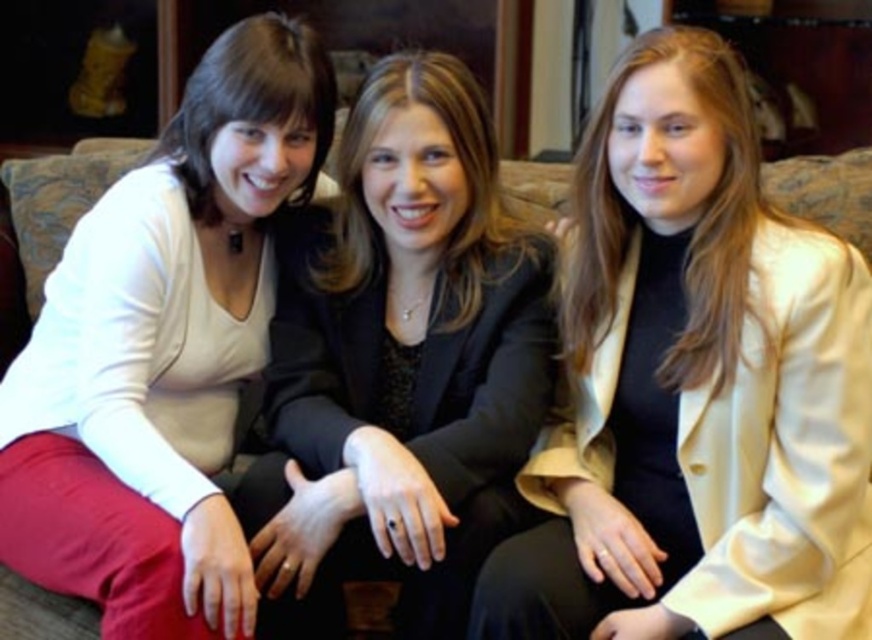
Question: Which of the following is the closest to the observer?

Choices:
 (A) (729, 282)
 (B) (142, 435)
 (C) (353, 268)

Answer: (A)

Question: Can you confirm if matte white blouse at left is smaller than black satin blazer at center?

Choices:
 (A) no
 (B) yes

Answer: (A)

Question: Which point is closer to the camera?

Choices:
 (A) (237, 566)
 (B) (419, 381)
 (C) (523, 476)

Answer: (A)

Question: Observing the image, what is the correct spatial positioning of matte white blouse at left in reference to black satin blazer at center?

Choices:
 (A) right
 (B) left

Answer: (B)

Question: Among these objects, which one is farthest from the camera?

Choices:
 (A) black satin blazer at center
 (B) matte white blouse at left
 (C) satin beige blazer at center

Answer: (A)

Question: Is satin beige blazer at center bigger than black satin blazer at center?

Choices:
 (A) no
 (B) yes

Answer: (B)